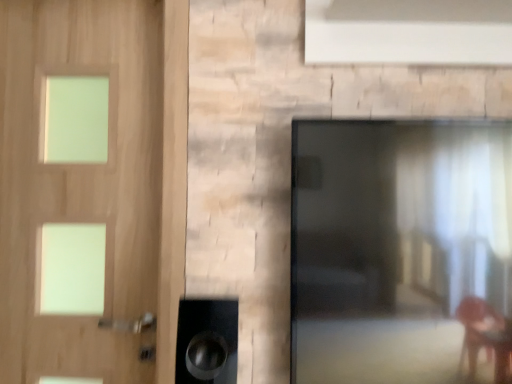
The height and width of the screenshot is (384, 512). Describe the element at coordinates (398, 249) in the screenshot. I see `black glossy screen door at right` at that location.

Where is `black glossy screen door at right`? This screenshot has width=512, height=384. black glossy screen door at right is located at coordinates (398, 249).

What do you see at coordinates (81, 182) in the screenshot? I see `light wood door at left` at bounding box center [81, 182].

The width and height of the screenshot is (512, 384). I want to click on light wood door at left, so click(81, 182).

Identify the location of black glossy screen door at right. This screenshot has width=512, height=384. [398, 249].

Does black glossy screen door at right appear on the right side of light wood door at left?

Yes, black glossy screen door at right is to the right of light wood door at left.

Is the position of black glossy screen door at right less distant than that of light wood door at left?

Yes, black glossy screen door at right is in front of light wood door at left.

Considering the points (377, 217) and (90, 10), which point is behind, point (377, 217) or point (90, 10)?

The point (90, 10) is more distant.

Consider the image. From the image's perspective, is black glossy screen door at right on top of light wood door at left?

No.

From a real-world perspective, which object stands above the other?

light wood door at left is physically above.

Which object is thinner, black glossy screen door at right or light wood door at left?

light wood door at left is thinner.

Considering the sizes of objects black glossy screen door at right and light wood door at left in the image provided, who is shorter, black glossy screen door at right or light wood door at left?

With less height is black glossy screen door at right.

Looking at the image, does black glossy screen door at right seem bigger or smaller compared to light wood door at left?

black glossy screen door at right is smaller than light wood door at left.

In the scene shown: Is black glossy screen door at right not inside light wood door at left?

Yes, black glossy screen door at right is outside of light wood door at left.

Is black glossy screen door at right placed right next to light wood door at left?

No, black glossy screen door at right is not next to light wood door at left.

Is black glossy screen door at right facing towards light wood door at left?

No.

How many degrees apart are the facing directions of black glossy screen door at right and light wood door at left?

They differ by 0.0009 degrees in their facing directions.

How far apart are black glossy screen door at right and light wood door at left?

A distance of 25.11 inches exists between black glossy screen door at right and light wood door at left.

Where is `door above the black glossy screen door at right (from the image's perspective)`? This screenshot has width=512, height=384. door above the black glossy screen door at right (from the image's perspective) is located at coordinates (81, 182).

Which object is positioned more to the left, light wood door at left or black glossy screen door at right?

light wood door at left.

Is light wood door at left behind black glossy screen door at right?

Yes, light wood door at left is further from the camera.

Considering the points (121, 100) and (327, 297), which point is behind, point (121, 100) or point (327, 297)?

The point (121, 100) is farther from the camera.

From the image's perspective, relative to black glossy screen door at right, is light wood door at left above or below?

light wood door at left is above black glossy screen door at right.

From a real-world perspective, which object stands above the other?

From a 3D spatial view, light wood door at left is above.

Considering the sizes of light wood door at left and black glossy screen door at right in the image, is light wood door at left wider or thinner than black glossy screen door at right?

Clearly, light wood door at left has less width compared to black glossy screen door at right.

From their relative heights in the image, would you say light wood door at left is taller or shorter than black glossy screen door at right?

Clearly, light wood door at left is taller compared to black glossy screen door at right.

Consider the image. Is light wood door at left bigger or smaller than black glossy screen door at right?

In the image, light wood door at left appears to be larger than black glossy screen door at right.

Is light wood door at left spatially inside black glossy screen door at right, or outside of it?

The correct answer is: outside.

Is the surface of light wood door at left in direct contact with black glossy screen door at right?

No, light wood door at left is not next to black glossy screen door at right.

Looking at this image, is light wood door at left oriented away from black glossy screen door at right?

No.

Image resolution: width=512 pixels, height=384 pixels. I want to click on door that appears above the black glossy screen door at right (from the image's perspective), so click(x=81, y=182).

The height and width of the screenshot is (384, 512). Find the location of `door behind the black glossy screen door at right`. door behind the black glossy screen door at right is located at coordinates (81, 182).

Find the location of `door located above the black glossy screen door at right (from a real-world perspective)`. door located above the black glossy screen door at right (from a real-world perspective) is located at coordinates (81, 182).